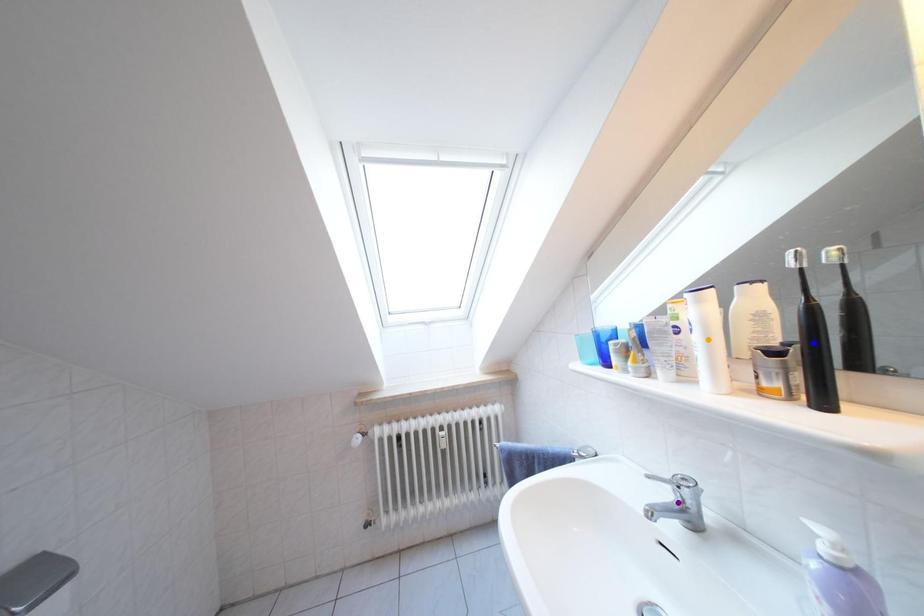
Order these from nearest to farthest:
- blue point
- purple point
- orange point

blue point
orange point
purple point